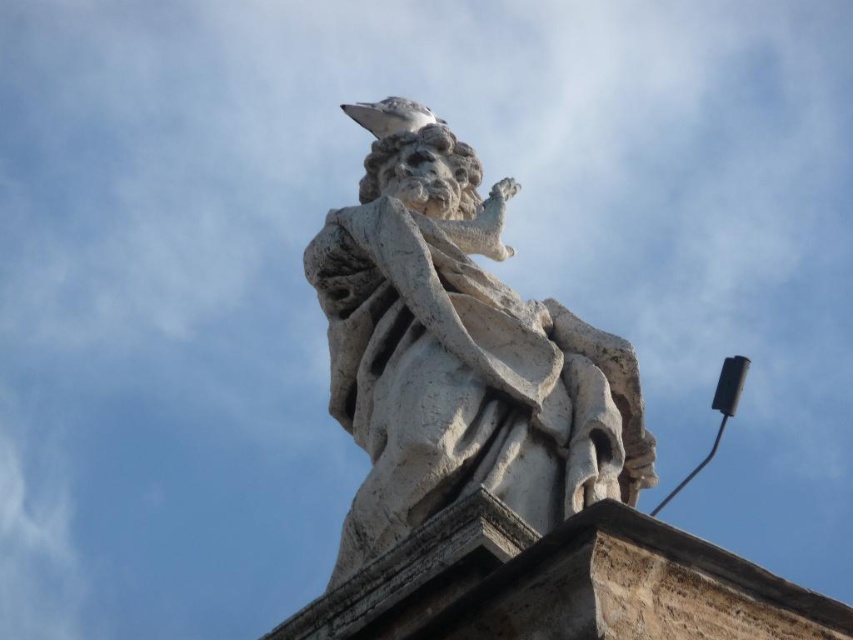
Question: Which point appears farthest from the camera in this image?

Choices:
 (A) (432, 445)
 (B) (363, 104)

Answer: (B)

Question: Is white stone statue at center closer to the viewer compared to white matte pigeon at upper center?

Choices:
 (A) no
 (B) yes

Answer: (B)

Question: Is white stone statue at center below white matte pigeon at upper center?

Choices:
 (A) no
 (B) yes

Answer: (B)

Question: Which of the following is the closest to the observer?

Choices:
 (A) (490, 294)
 (B) (373, 125)

Answer: (A)

Question: Where is white stone statue at center located in relation to white matte pigeon at upper center in the image?

Choices:
 (A) above
 (B) below

Answer: (B)